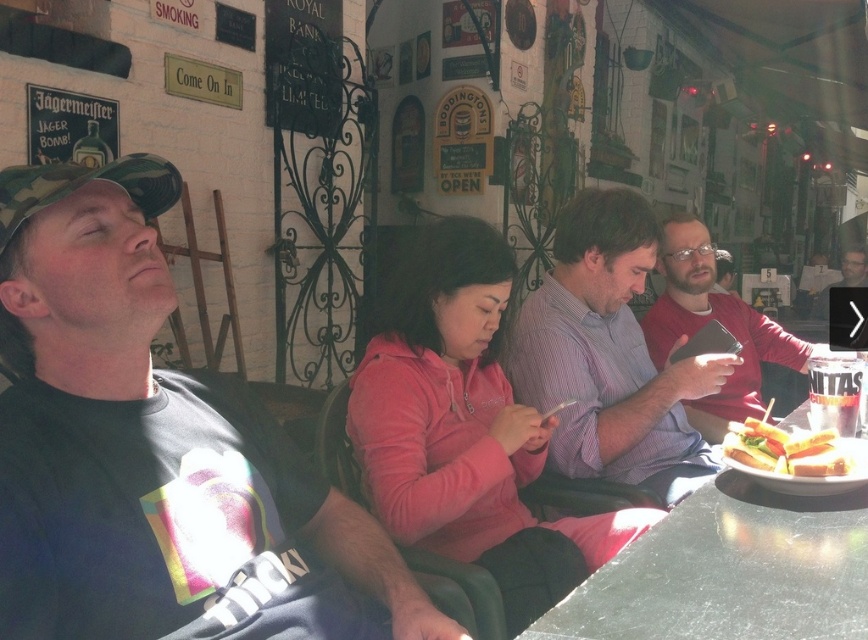
Can you confirm if light blue striped shirt at center is shorter than white bread sandwich at lower right?

Incorrect, light blue striped shirt at center's height does not fall short of white bread sandwich at lower right's.

Is point (648, 257) more distant than point (812, 454)?

Yes, it is behind point (812, 454).

Locate an element on the screen. light blue striped shirt at center is located at coordinates (609, 355).

Which of these two, green marble table at center or matte red shirt at center, stands taller?

matte red shirt at center

Which is behind, point (826, 529) or point (713, 442)?

Positioned behind is point (713, 442).

Which is behind, point (838, 552) or point (699, 301)?

The point (699, 301) is more distant.

Where is `green marble table at center`? The image size is (868, 640). green marble table at center is located at coordinates (730, 572).

Is point (192, 604) farther from viewer compared to point (673, 252)?

No, it is in front of (673, 252).

Which is more to the left, dark blue t-shirt at left or matte red shirt at center?

Positioned to the left is dark blue t-shirt at left.

I want to click on dark blue t-shirt at left, so click(x=153, y=451).